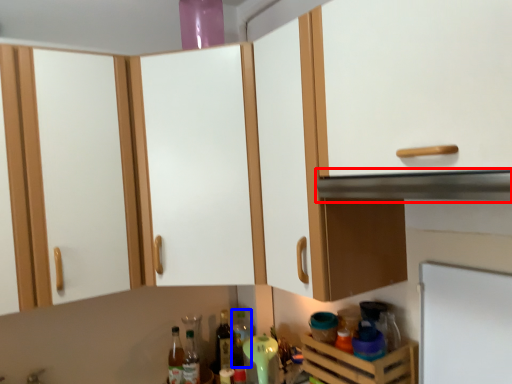
Question: Which of the following is the closest to the observer, vent (highlighted by a red box) or bottle (highlighted by a blue box)?

Choices:
 (A) vent
 (B) bottle

Answer: (A)